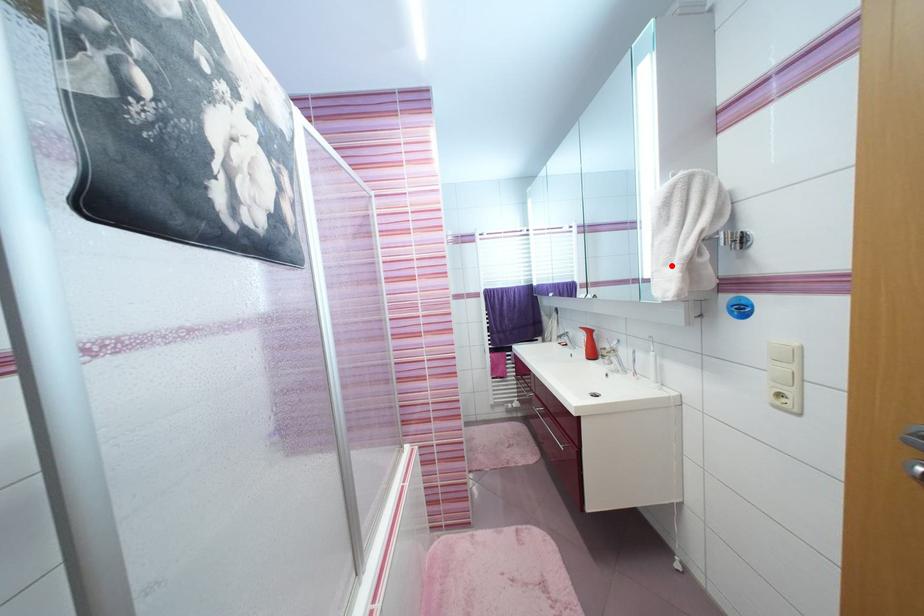
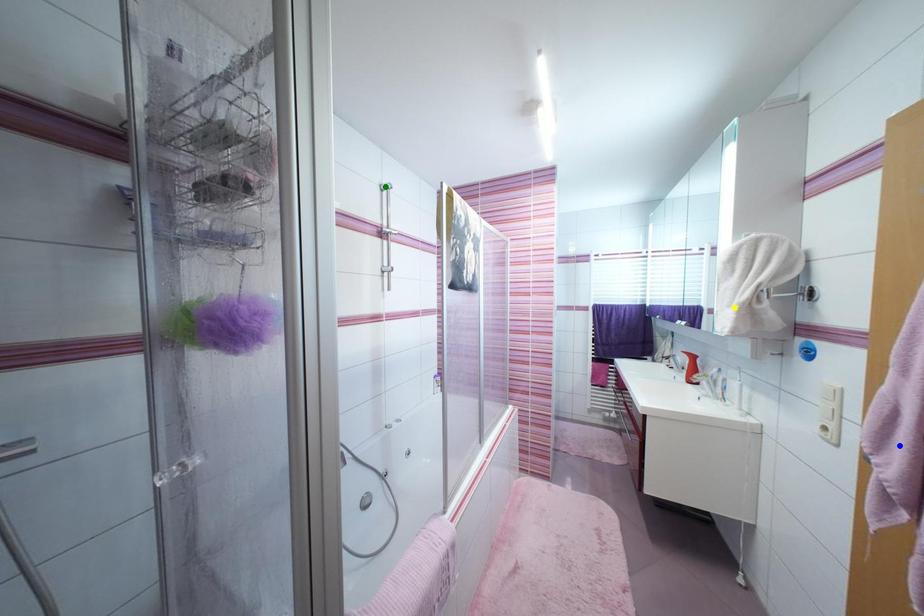
Question: I am providing you with two images of the same scene from different viewpoints. A red point is marked on the first image. You are given multiple points on the second image. Which point in image 2 represents the same 3d spot as the red point in image 1?

Choices:
 (A) green point
 (B) blue point
 (C) yellow point

Answer: (C)